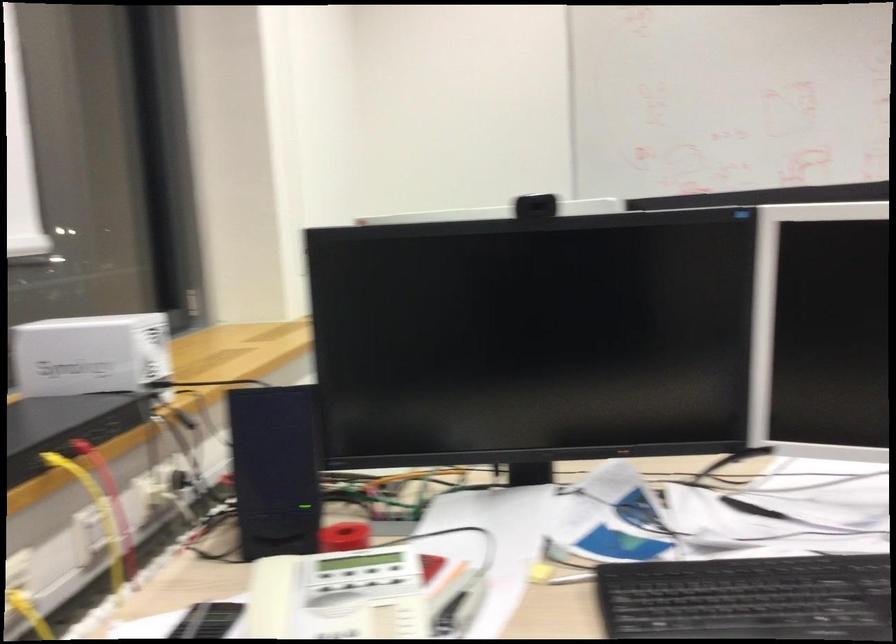
What do you see at coordinates (748, 598) in the screenshot?
I see `the black computer keyboard` at bounding box center [748, 598].